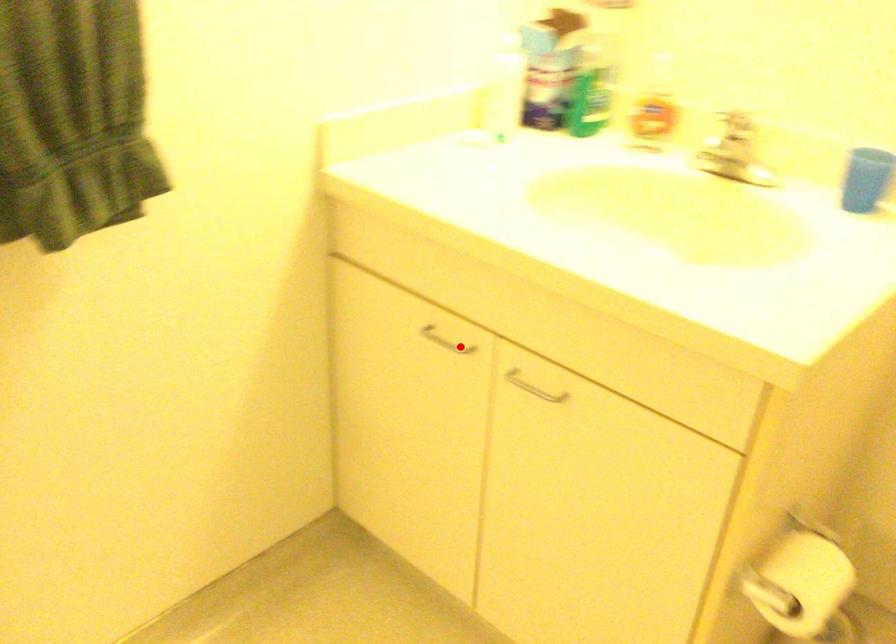
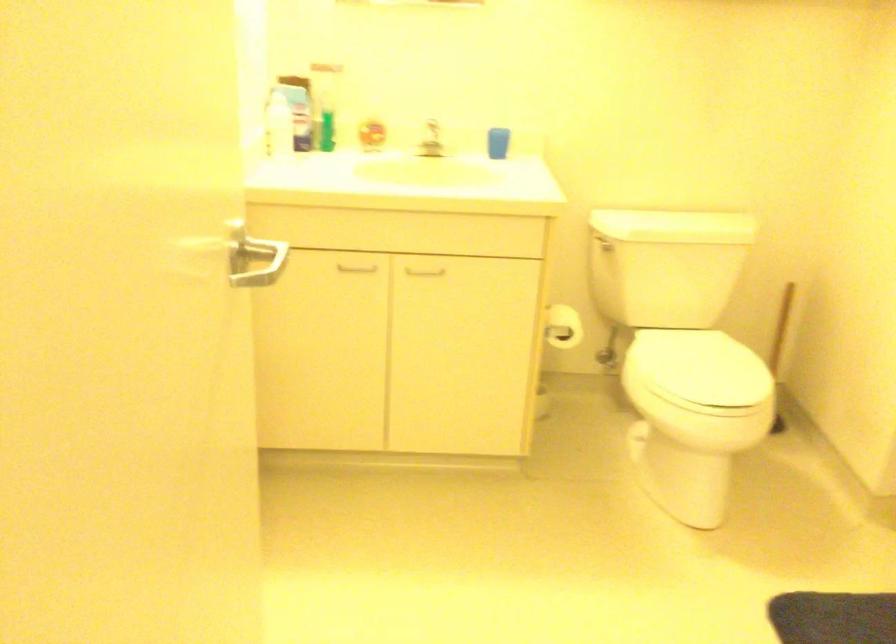
Find the pixel in the second image that matches the highlighted location in the first image.

(356, 269)